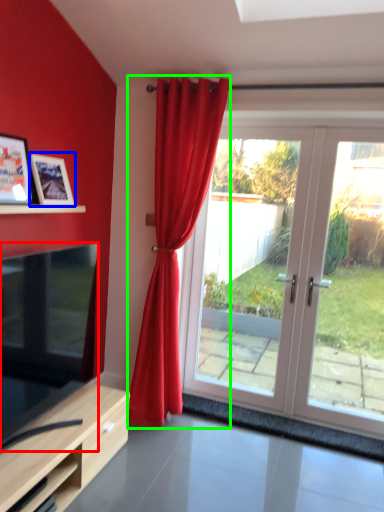
Question: Based on their relative distances, which object is farther from television (highlighted by a red box)? Choose from picture frame (highlighted by a blue box) and curtain (highlighted by a green box).

Choices:
 (A) picture frame
 (B) curtain

Answer: (B)